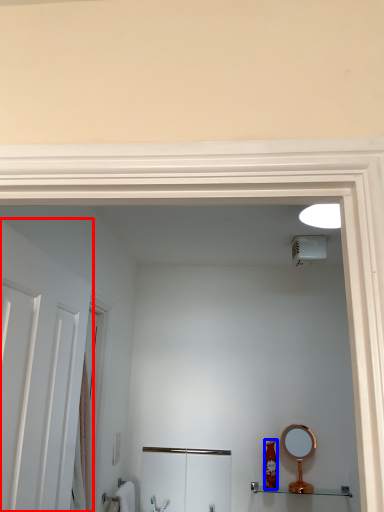
Question: Which point is further to the camera, door (highlighted by a red box) or toiletry (highlighted by a blue box)?

Choices:
 (A) door
 (B) toiletry

Answer: (B)